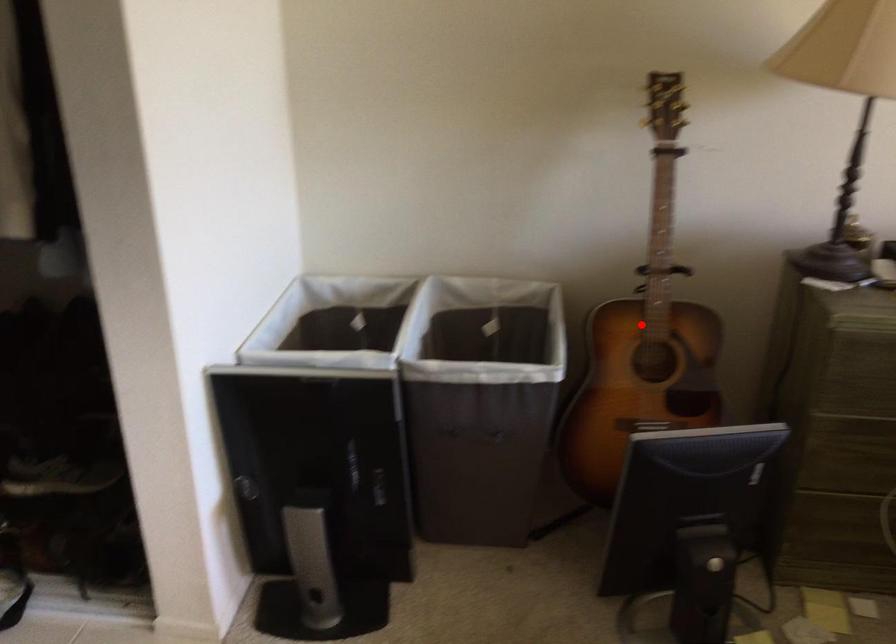
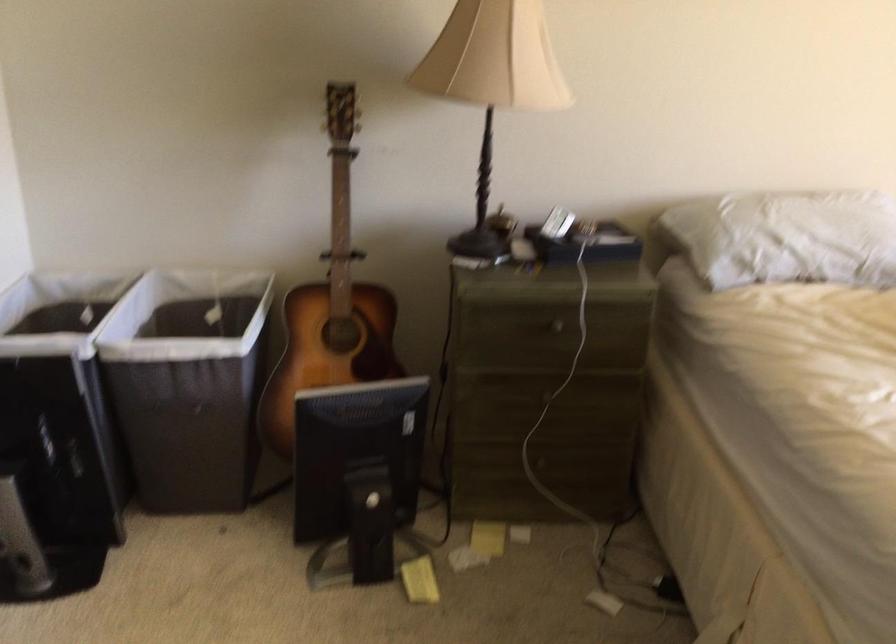
Question: I am providing you with two images of the same scene from different viewpoints. A red point is marked on the first image. Can you still see the location of the red point in image 2?

Choices:
 (A) Yes
 (B) No

Answer: (A)